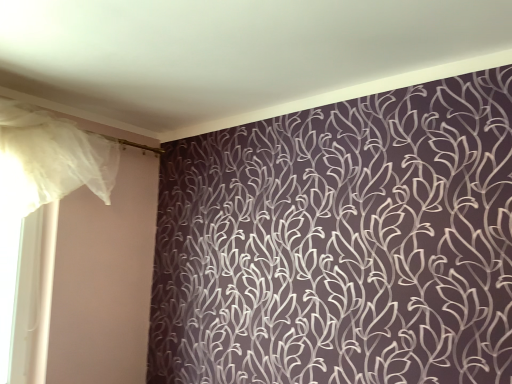
Where is `white sheer curtain at left`? This screenshot has width=512, height=384. white sheer curtain at left is located at coordinates (50, 159).

Describe the element at coordinates (50, 159) in the screenshot. I see `white sheer curtain at left` at that location.

Measure the distance between white sheer curtain at left and camera.

A distance of 7.12 feet exists between white sheer curtain at left and camera.

This screenshot has height=384, width=512. Identify the location of white sheer curtain at left. (50, 159).